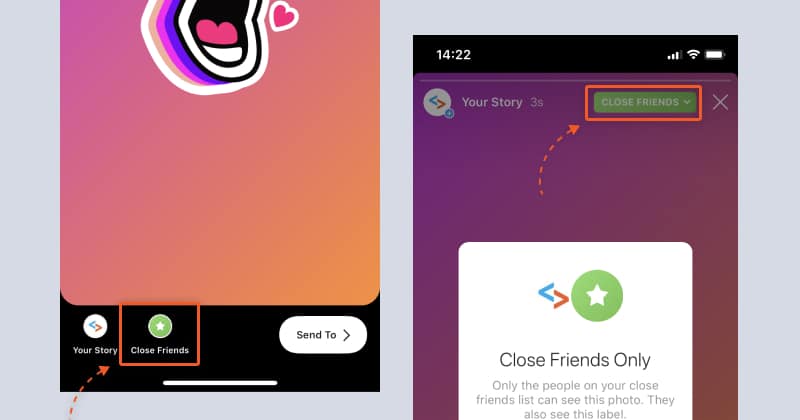
Find the location of a particular element. The height and width of the screenshot is (420, 800). clock is located at coordinates (450, 53).